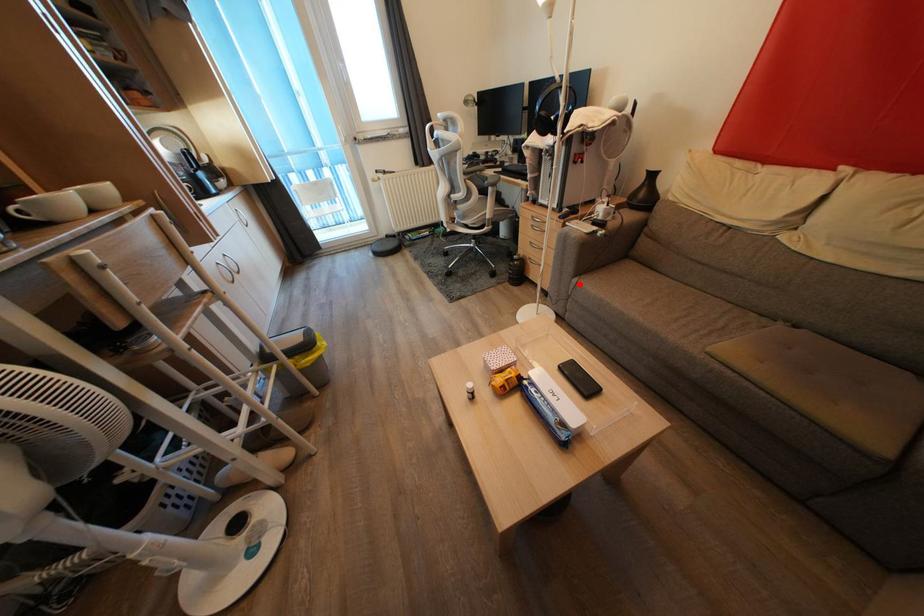
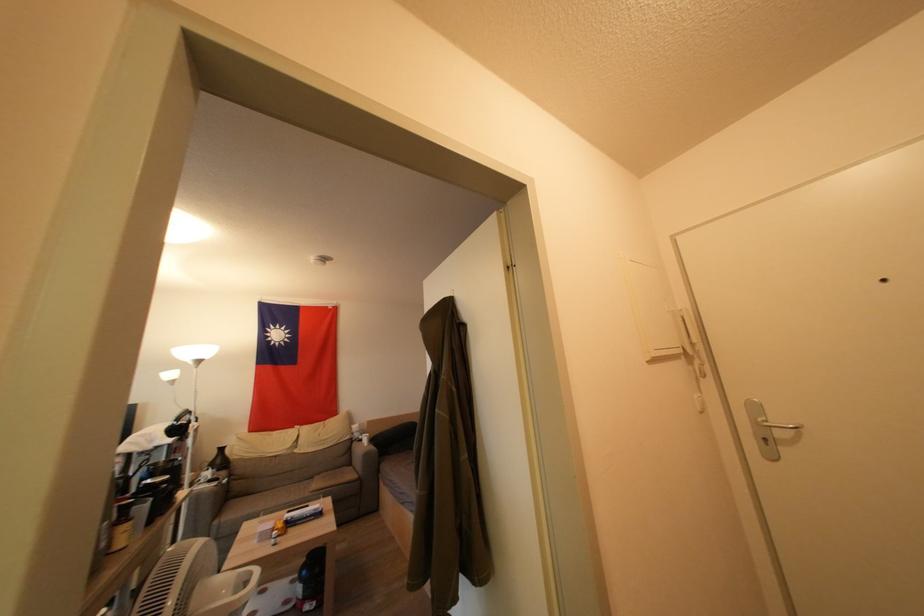
Question: I am providing you with two images of the same scene from different viewpoints. Image1 has a red point marked. In image2, the corresponding 3D location appears at what relative position? Reply with the corresponding letter.

Choices:
 (A) Closer
 (B) Farther

Answer: (B)